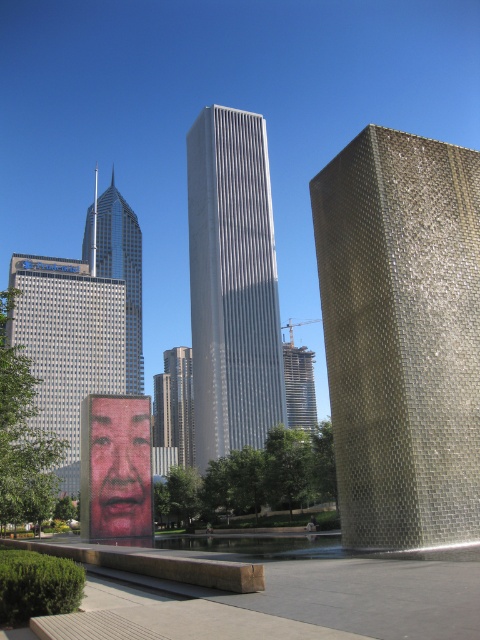
You are an architect designing a new public space and want to place a sculpture in the area where the brick wall is located. The coordinates for the wall are at point (402,336). Can you confirm if this point is within the boundaries of the brick wall at the right side of the water feature?

The brick wall at the right is represented by the point (402,336), so yes, placing the sculpture at that coordinate would be within the boundaries of the brick wall at the right side of the water feature.

You are standing in the urban scene and want to take a photo of both the large digital display screen and the metallic cube structure. You notice two points marked on your map at coordinates point (127, 516) and point (115, 266). According to the map, which point should you stand at to ensure both the large digital display screen and the metallic cube structure are fully visible in your photo?

You should stand at point (115, 266) because point (127, 516) is in front of it, meaning standing at the latter might block the view of the metallic cube structure behind.

You are standing in the urban scene and want to determine the relative positions of two points marked in the image. Which point is closer to you, the point at coordinates point (66, 332) or point (179, 460)?

The point at coordinates point (66, 332) is closer to the viewer than point (179, 460).